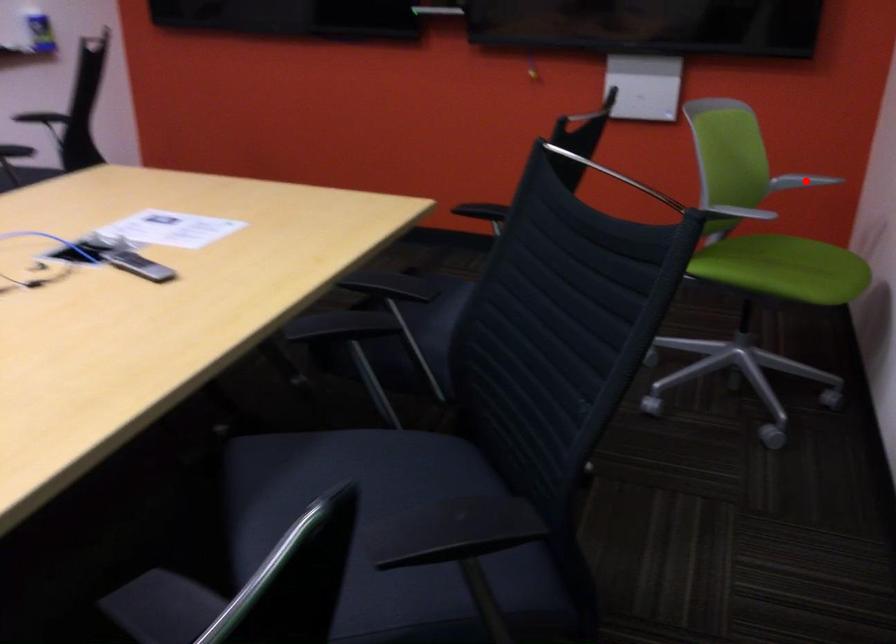
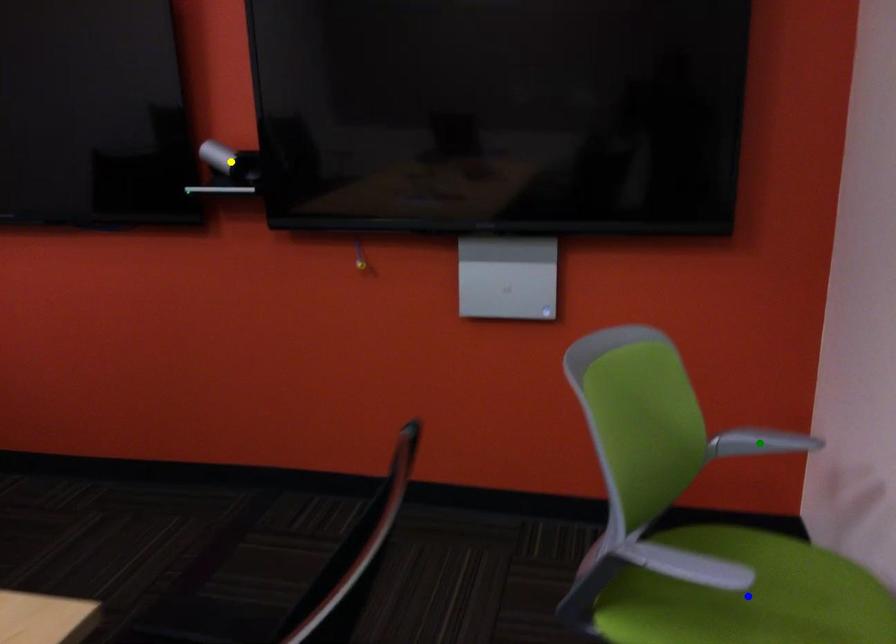
Question: I am providing you with two images of the same scene from different viewpoints. A red point is marked on the first image. You are given multiple points on the second image. Which point in image 2 is actually the same real-world point as the red point in image 1?

Choices:
 (A) blue point
 (B) yellow point
 (C) green point

Answer: (C)